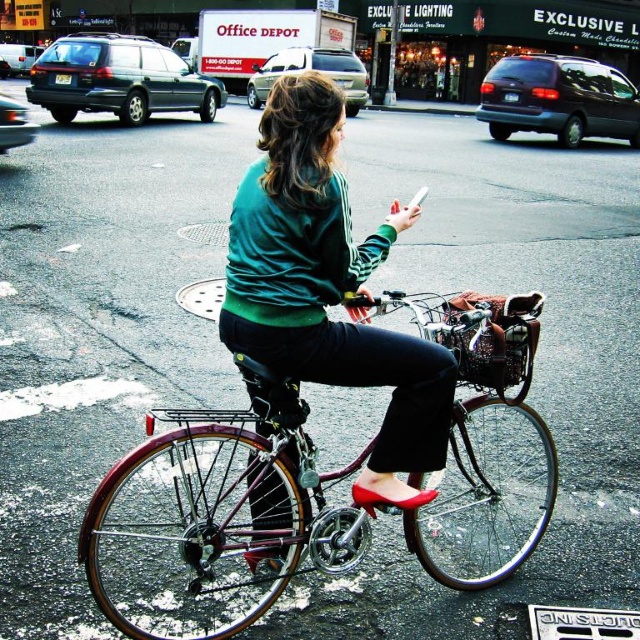
Question: Which object is farther from the camera taking this photo?

Choices:
 (A) white plastic smartphone at center
 (B) green matte sweater at center

Answer: (A)

Question: Can you confirm if green matte sweater at center is smaller than white plastic smartphone at center?

Choices:
 (A) yes
 (B) no

Answer: (A)

Question: Is green matte sweater at center to the right of metallic silver basket at center from the viewer's perspective?

Choices:
 (A) no
 (B) yes

Answer: (A)

Question: Among these points, which one is nearest to the camera?

Choices:
 (A) (406, 205)
 (B) (332, 193)
 (C) (544, 300)

Answer: (B)

Question: Is shiny metallic bicycle at center in front of metallic silver basket at center?

Choices:
 (A) yes
 (B) no

Answer: (A)

Question: Estimate the real-world distances between objects in this image. Which object is closer to the green matte sweater at center?

Choices:
 (A) white plastic smartphone at center
 (B) shiny metallic bicycle at center
 (C) metallic silver basket at center

Answer: (C)